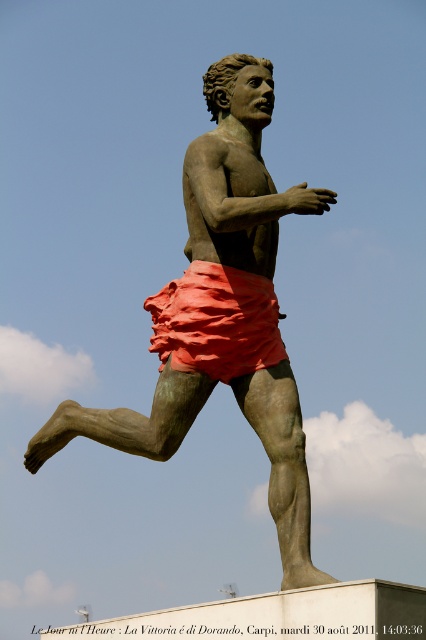
Between point (233, 385) and point (268, 310), which one is positioned behind?

Point (233, 385)

Which of these two, bronze statue at center or matte orange fabric shorts at center, stands shorter?

With less height is matte orange fabric shorts at center.

The image size is (426, 640). What do you see at coordinates (221, 314) in the screenshot?
I see `bronze statue at center` at bounding box center [221, 314].

Locate an element on the screen. The width and height of the screenshot is (426, 640). bronze statue at center is located at coordinates (221, 314).